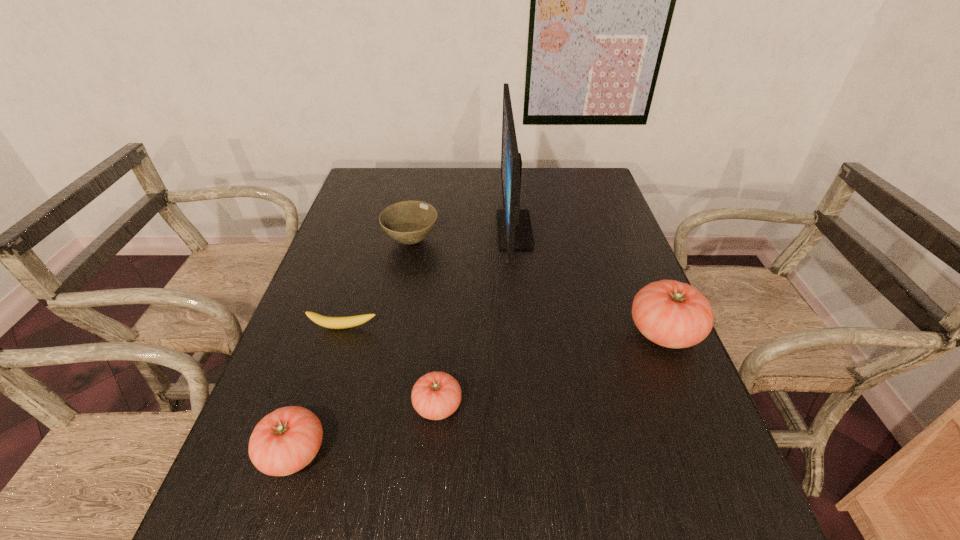
Locate an element on the screen. The image size is (960, 540). vacant space positioned 0.090m on the right of the second tomato from right to left is located at coordinates (506, 406).

The image size is (960, 540). Find the location of `free space located on the front of the tallest tomato`. free space located on the front of the tallest tomato is located at coordinates (704, 427).

Image resolution: width=960 pixels, height=540 pixels. Identify the location of vacant space situated 0.350m on the screen side of the computer monitor. [385, 229].

Image resolution: width=960 pixels, height=540 pixels. Identify the location of vacant area situated 0.340m on the screen side of the computer monitor. pyautogui.click(x=388, y=229).

You are a GUI agent. You are given a task and a screenshot of the screen. Output one action in this format:
    pyautogui.click(x=<x>, y=<y>)
    Task: Click on the vacant space situated 0.190m on the screen side of the computer monitor
    Image resolution: width=960 pixels, height=540 pixels.
    Given the screenshot: What is the action you would take?
    pyautogui.click(x=436, y=229)

Find the location of a particular element. free point located on the back of the bowl is located at coordinates (417, 214).

Find the location of a particular element. free space located 0.370m on the upward curve of the shortest object is located at coordinates (293, 489).

Identify the location of object at the far edge. Image resolution: width=960 pixels, height=540 pixels. tap(514, 229).

At what (x,y) coordinates should I click in order to perform the action: click on object present at the near edge. Please return your answer as a coordinate pair (x, y). The image size is (960, 540). Looking at the image, I should click on (286, 440).

At what (x,y) coordinates should I click in order to perform the action: click on tomato located in the left edge section of the desktop. Please return your answer as a coordinate pair (x, y). Image resolution: width=960 pixels, height=540 pixels. Looking at the image, I should click on (286, 440).